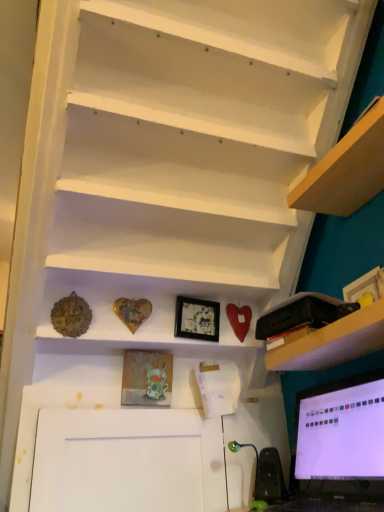
Question: Should I look upward or downward to see black plastic bag at upper right?

Choices:
 (A) up
 (B) down

Answer: (B)

Question: Is black glossy picture frame at center, acting as the 2th picture frame starting from the bottom, directly adjacent to matte black monitor at lower right?

Choices:
 (A) no
 (B) yes

Answer: (A)

Question: From the image's perspective, does black glossy picture frame at center, arranged as the 1th picture frame when viewed from the right, appear higher than matte black monitor at lower right?

Choices:
 (A) yes
 (B) no

Answer: (A)

Question: From a real-world perspective, is black glossy picture frame at center, arranged as the 1th picture frame when viewed from the right, physically below matte black monitor at lower right?

Choices:
 (A) yes
 (B) no

Answer: (B)

Question: Is black glossy picture frame at center, arranged as the 1th picture frame when viewed from the right, outside of matte black monitor at lower right?

Choices:
 (A) no
 (B) yes

Answer: (B)

Question: Is black glossy picture frame at center, acting as the 2th picture frame starting from the bottom, further to the viewer compared to matte black monitor at lower right?

Choices:
 (A) yes
 (B) no

Answer: (A)

Question: Does black glossy picture frame at center, arranged as the 1th picture frame when viewed from the right, have a lesser height compared to matte black monitor at lower right?

Choices:
 (A) no
 (B) yes

Answer: (B)

Question: Is matte black monitor at lower right aimed at wooden textured picture frame at center, the 1th picture frame positioned from the bottom?

Choices:
 (A) yes
 (B) no

Answer: (A)

Question: Is matte black monitor at lower right to the left of wooden textured picture frame at center, the first picture frame viewed from the left, from the viewer's perspective?

Choices:
 (A) no
 (B) yes

Answer: (A)

Question: From the image's perspective, is matte black monitor at lower right under wooden textured picture frame at center, the 2th picture frame from the top?

Choices:
 (A) no
 (B) yes

Answer: (B)

Question: From a real-world perspective, is matte black monitor at lower right physically above wooden textured picture frame at center, the first picture frame viewed from the left?

Choices:
 (A) yes
 (B) no

Answer: (B)

Question: Is wooden textured picture frame at center, the 2th picture frame from the top, completely or partially inside matte black monitor at lower right?

Choices:
 (A) yes
 (B) no

Answer: (B)

Question: From a real-world perspective, is matte black monitor at lower right located beneath wooden textured picture frame at center, the 2th picture frame from the top?

Choices:
 (A) yes
 (B) no

Answer: (A)

Question: Is green rubber speaker at lower right thinner than white matte stairs at upper center?

Choices:
 (A) yes
 (B) no

Answer: (A)